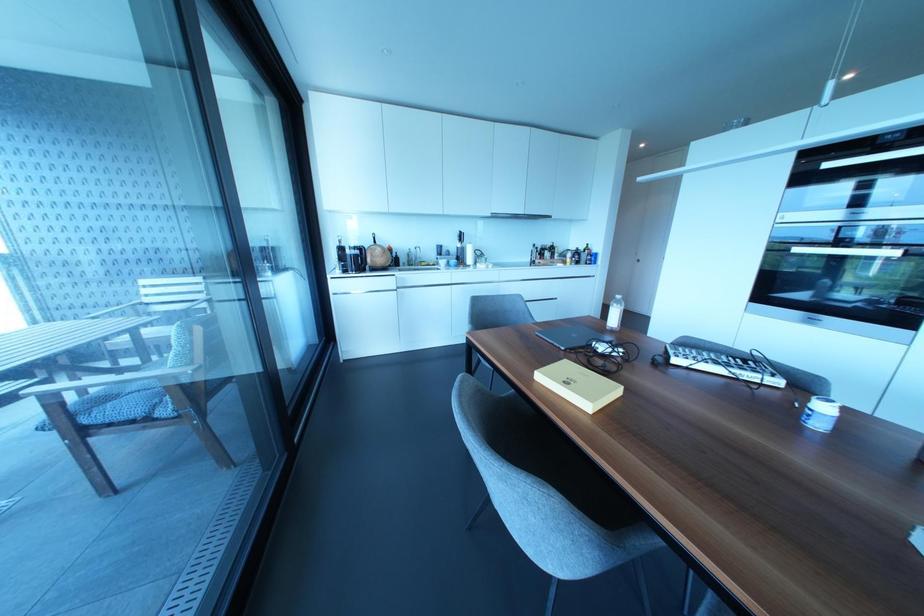
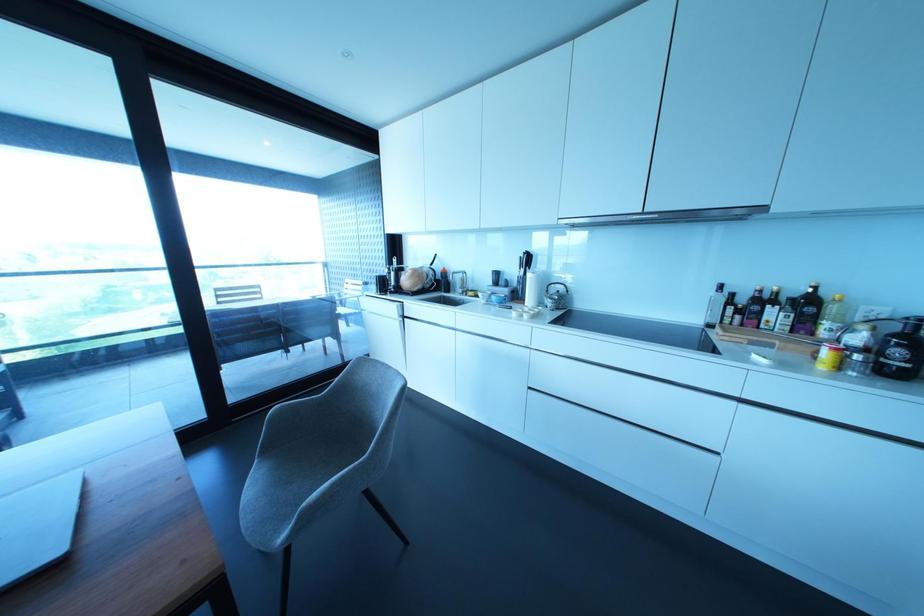
Where in the second image is the point corresponding to point 551,248 from the first image?

(807, 304)